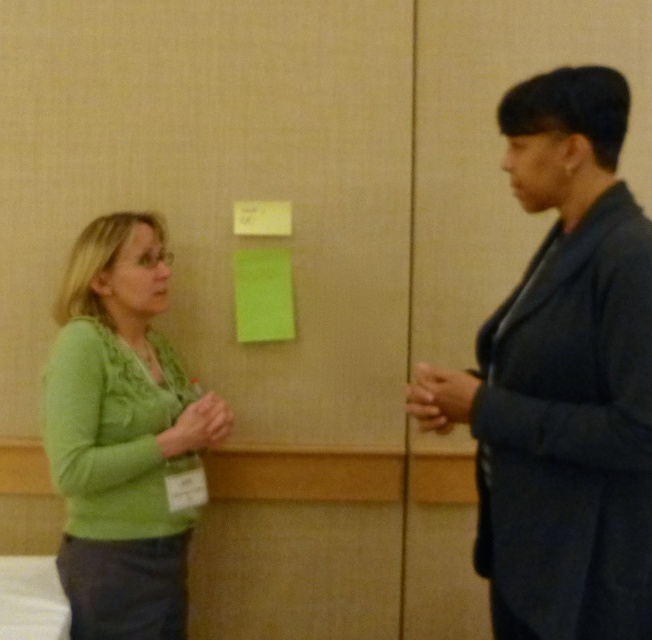
Question: Among these points, which one is farthest from the camera?

Choices:
 (A) (149, 285)
 (B) (526, 419)

Answer: (A)

Question: Is dark blue suit at right positioned at the back of green soft sweater at left?

Choices:
 (A) yes
 (B) no

Answer: (B)

Question: Among these objects, which one is nearest to the camera?

Choices:
 (A) green soft sweater at left
 (B) dark blue suit at right

Answer: (B)

Question: Where is dark blue suit at right located in relation to green soft sweater at left in the image?

Choices:
 (A) right
 (B) left

Answer: (A)

Question: Can you confirm if dark blue suit at right is positioned to the left of green soft sweater at left?

Choices:
 (A) no
 (B) yes

Answer: (A)

Question: Which object appears closest to the camera in this image?

Choices:
 (A) green soft sweater at left
 (B) dark blue suit at right

Answer: (B)